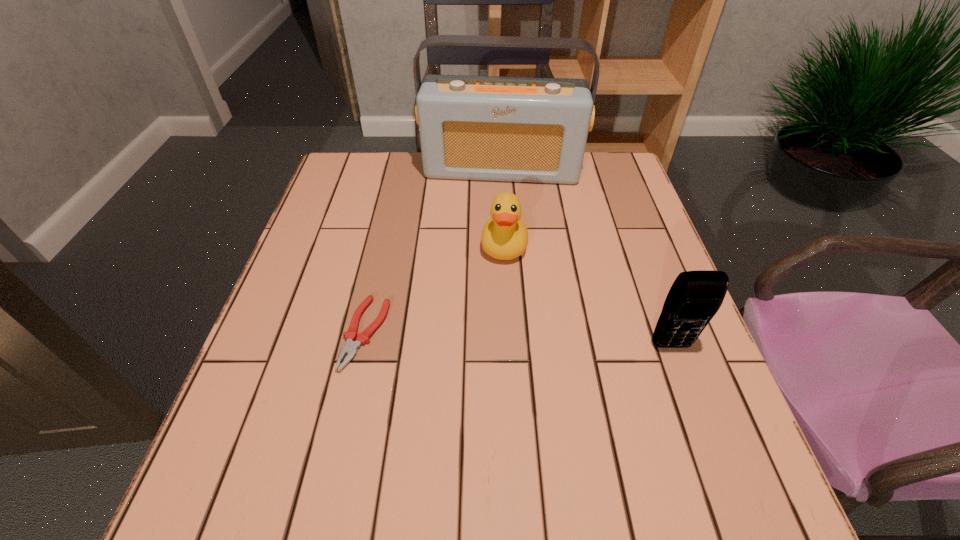
Locate an element on the screen. This screenshot has width=960, height=540. vacant space that is in between the pliers and the cellular telephone is located at coordinates (518, 339).

In order to click on unoccupied position between the rightmost object and the shortest object in this screenshot , I will do `click(518, 339)`.

Locate an element on the screen. vacant area that lies between the third nearest object and the leftmost object is located at coordinates (435, 289).

Where is `unoccupied area between the second tallest object and the leftmost object`? This screenshot has height=540, width=960. unoccupied area between the second tallest object and the leftmost object is located at coordinates (518, 339).

Select which object appears as the second closest to the second shortest object. Please provide its 2D coordinates. Your answer should be formatted as a tuple, i.e. [(x, y)], where the tuple contains the x and y coordinates of a point satisfying the conditions above.

[(350, 348)]

This screenshot has height=540, width=960. I want to click on object identified as the closest to the second shortest object, so click(520, 129).

In order to click on vacant position in the image that satisfies the following two spatial constraints: 1. on the back side of the shortest object; 2. on the right side of the duck in this screenshot , I will do `click(385, 245)`.

Find the location of a particular element. The image size is (960, 540). vacant space that satisfies the following two spatial constraints: 1. on the back side of the third tallest object; 2. on the left side of the farthest object is located at coordinates (500, 169).